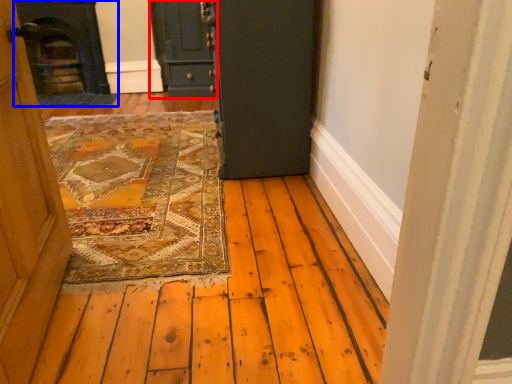
Question: Which object is closer to the camera taking this photo, door (highlighted by a red box) or fireplace (highlighted by a blue box)?

Choices:
 (A) door
 (B) fireplace

Answer: (A)